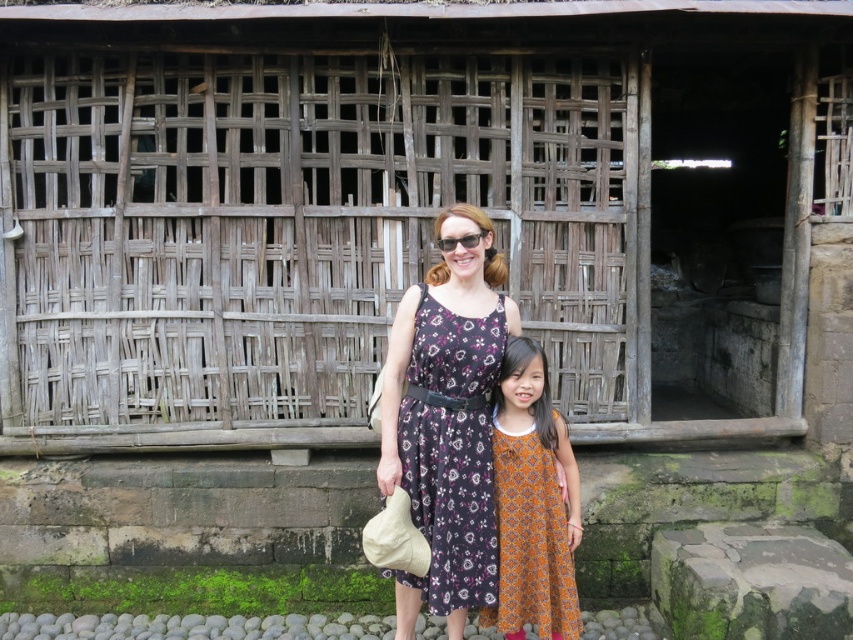
Question: Can you confirm if floral-patterned fabric dress at center is bigger than matte black sunglasses at center?

Choices:
 (A) yes
 (B) no

Answer: (A)

Question: Which object is farther from the camera taking this photo?

Choices:
 (A) orange printed dress at center
 (B) matte black sunglasses at center
 (C) floral-patterned fabric dress at center

Answer: (A)

Question: Among these objects, which one is nearest to the camera?

Choices:
 (A) floral-patterned fabric dress at center
 (B) matte black sunglasses at center

Answer: (A)

Question: Based on their relative distances, which object is farther from the orange printed dress at center?

Choices:
 (A) floral-patterned fabric dress at center
 (B) matte black sunglasses at center

Answer: (B)

Question: In this image, where is floral-patterned fabric dress at center located relative to orange printed dress at center?

Choices:
 (A) below
 (B) above

Answer: (B)

Question: Does floral-patterned fabric dress at center appear on the left side of matte black sunglasses at center?

Choices:
 (A) yes
 (B) no

Answer: (A)